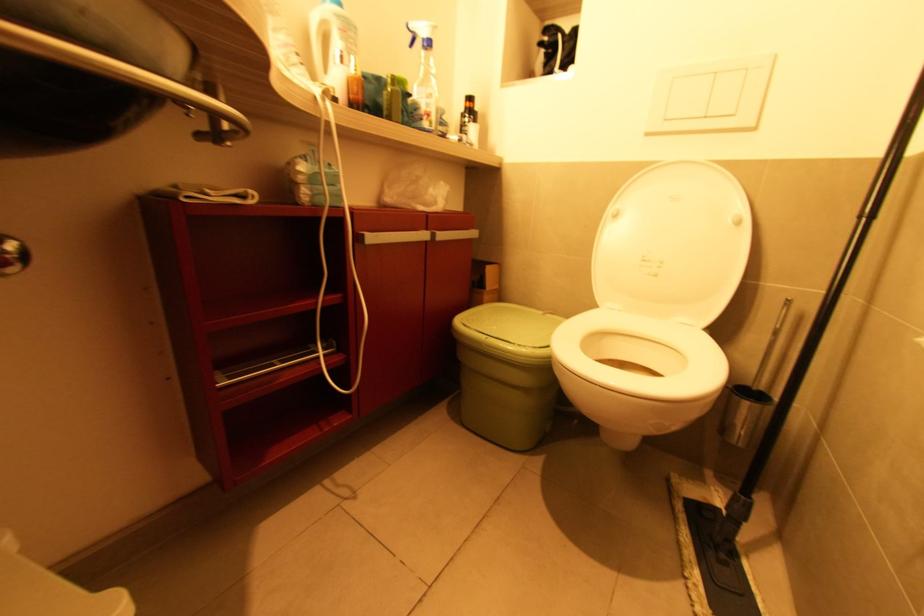
The width and height of the screenshot is (924, 616). What do you see at coordinates (673, 243) in the screenshot?
I see `the white toilet lid` at bounding box center [673, 243].